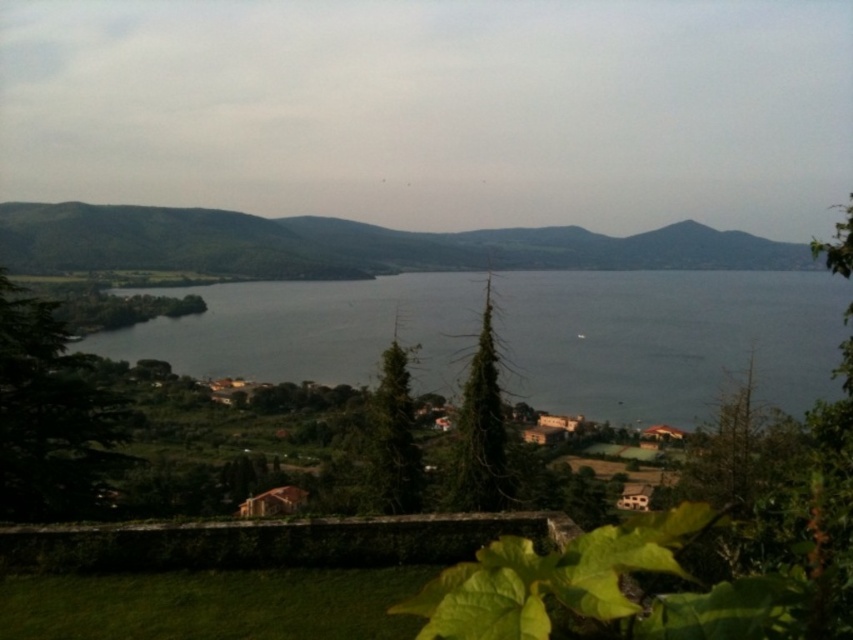
Which is above, gray water at center or green matte mountain at center?

green matte mountain at center is above.

Can you confirm if gray water at center is smaller than green matte mountain at center?

Yes.

What do you see at coordinates (665, 339) in the screenshot? I see `gray water at center` at bounding box center [665, 339].

Identify the location of gray water at center. (665, 339).